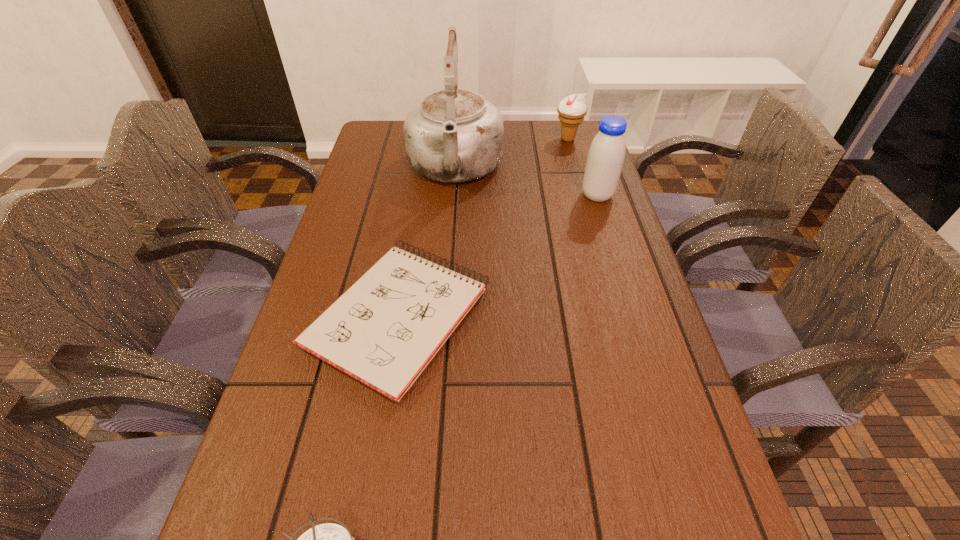
Image resolution: width=960 pixels, height=540 pixels. What are the coordinates of `free location at the far right corner of the desktop` in the screenshot? It's located at (586, 122).

Identify the location of free spot between the notepad and the third shortest object. (483, 228).

Locate an element on the screen. The width and height of the screenshot is (960, 540). vacant area that lies between the kettle and the fourth farthest object is located at coordinates (427, 243).

Where is `empty space that is in between the kettle and the notepad`? This screenshot has width=960, height=540. empty space that is in between the kettle and the notepad is located at coordinates (427, 243).

Locate an element on the screen. vacant area that lies between the shortest object and the soya milk is located at coordinates (498, 256).

This screenshot has height=540, width=960. I want to click on blank region between the kettle and the soya milk, so click(526, 183).

I want to click on the fourth closest object to the compass, so click(572, 109).

Identify the location of object identified as the second closest to the nearest object. Image resolution: width=960 pixels, height=540 pixels. (454, 135).

Where is `free space that satisfies the following two spatial constraints: 1. on the front side of the soya milk; 2. on the right side of the third shortest object`? The image size is (960, 540). free space that satisfies the following two spatial constraints: 1. on the front side of the soya milk; 2. on the right side of the third shortest object is located at coordinates (584, 195).

This screenshot has width=960, height=540. In order to click on free space that satisfies the following two spatial constraints: 1. at the spout of the second tallest object; 2. on the right side of the tallest object in this screenshot , I will do `click(453, 195)`.